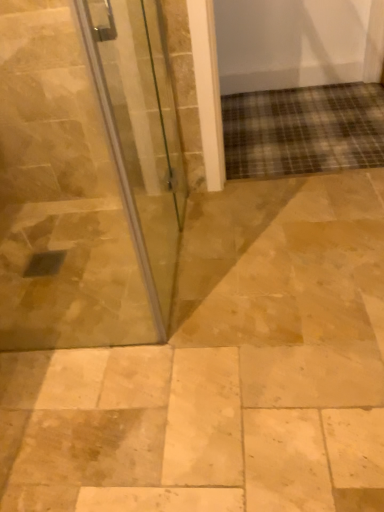
What do you see at coordinates (224, 371) in the screenshot? The image size is (384, 512). I see `natural stone tile at center` at bounding box center [224, 371].

You are a GUI agent. You are given a task and a screenshot of the screen. Output one action in this format:
    pyautogui.click(x=<x>, y=<y>)
    Task: Click on the natural stone tile at center
    Image resolution: width=384 pixels, height=512 pixels.
    Given the screenshot: What is the action you would take?
    pyautogui.click(x=224, y=371)

You are a GUI agent. You are given a task and a screenshot of the screen. Output one action in this format:
    pyautogui.click(x=<x>, y=<y>)
    Task: Click on the transparent glass door at left
    
    Given the screenshot: What is the action you would take?
    pyautogui.click(x=140, y=133)

What do you see at coordinates (140, 133) in the screenshot? I see `transparent glass door at left` at bounding box center [140, 133].

Locate an element on the screen. The width and height of the screenshot is (384, 512). natural stone tile at center is located at coordinates (224, 371).

Is natural stone tile at center to the left or to the right of transparent glass door at left in the image?

Clearly, natural stone tile at center is on the right of transparent glass door at left in the image.

Considering their positions, is natural stone tile at center located in front of or behind transparent glass door at left?

In the image, natural stone tile at center appears behind transparent glass door at left.

Is point (77, 499) closer or farther from the camera than point (125, 149)?

Point (77, 499) is positioned closer to the camera compared to point (125, 149).

From the image's perspective, between natural stone tile at center and transparent glass door at left, who is located below?

natural stone tile at center, from the image's perspective.

From a real-world perspective, is natural stone tile at center positioned above or below transparent glass door at left?

In terms of real-world spatial position, natural stone tile at center is below transparent glass door at left.

Does natural stone tile at center have a greater width compared to transparent glass door at left?

Indeed, natural stone tile at center has a greater width compared to transparent glass door at left.

Considering the relative sizes of natural stone tile at center and transparent glass door at left in the image provided, is natural stone tile at center shorter than transparent glass door at left?

Correct, natural stone tile at center is not as tall as transparent glass door at left.

In terms of size, does natural stone tile at center appear bigger or smaller than transparent glass door at left?

Considering their sizes, natural stone tile at center takes up more space than transparent glass door at left.

Is natural stone tile at center inside or outside of transparent glass door at left?

The correct answer is: outside.

Would you consider natural stone tile at center to be distant from transparent glass door at left?

natural stone tile at center is near transparent glass door at left, not far away.

Is natural stone tile at center facing towards transparent glass door at left?

No, natural stone tile at center is not aimed at transparent glass door at left.

Based on the photo, measure the distance from natural stone tile at center to transparent glass door at left.

They are 15.44 inches apart.

Locate an element on the screen. path that appears below the transparent glass door at left (from a real-world perspective) is located at coordinates (224, 371).

Does transparent glass door at left appear on the left side of natural stone tile at center?

Yes.

Which object is closer to the camera taking this photo, transparent glass door at left or natural stone tile at center?

transparent glass door at left is in front.

Between point (110, 38) and point (198, 389), which one is positioned behind?

Point (198, 389)

From the image's perspective, does transparent glass door at left appear lower than natural stone tile at center?

No.

From a real-world perspective, is transparent glass door at left beneath natural stone tile at center?

No.

Which object is wider, transparent glass door at left or natural stone tile at center?

natural stone tile at center.

Is transparent glass door at left taller or shorter than natural stone tile at center?

Clearly, transparent glass door at left is taller compared to natural stone tile at center.

Considering the relative sizes of transparent glass door at left and natural stone tile at center in the image provided, is transparent glass door at left bigger than natural stone tile at center?

Actually, transparent glass door at left might be smaller than natural stone tile at center.

Would you say transparent glass door at left is inside or outside natural stone tile at center?

transparent glass door at left is outside natural stone tile at center.

Are transparent glass door at left and natural stone tile at center beside each other?

No, transparent glass door at left is not next to natural stone tile at center.

Is transparent glass door at left facing towards natural stone tile at center?

No, transparent glass door at left is not turned towards natural stone tile at center.

Can you tell me how much transparent glass door at left and natural stone tile at center differ in facing direction?

They differ by 89.1 degrees in their facing directions.

In order to click on door in front of the natural stone tile at center in this screenshot , I will do `click(140, 133)`.

You are a GUI agent. You are given a task and a screenshot of the screen. Output one action in this format:
    pyautogui.click(x=<x>, y=<y>)
    Task: Click on the path behind the transparent glass door at left
    
    Given the screenshot: What is the action you would take?
    pyautogui.click(x=224, y=371)

Image resolution: width=384 pixels, height=512 pixels. I want to click on door that appears on the left of natural stone tile at center, so click(x=140, y=133).